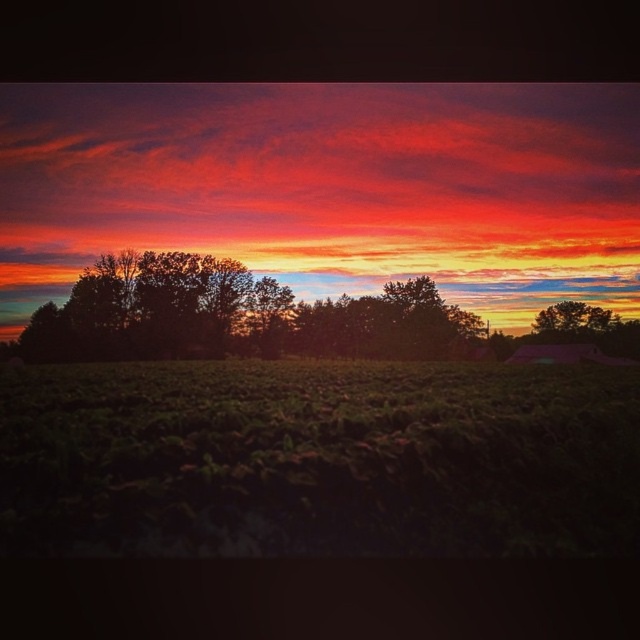
You are an artist trying to paint the sunset scene. You want to ensure the vivid orange cloud at upper center and the green leafy tree at right are proportionally accurate. Which object should you paint larger?

The vivid orange cloud at upper center should be painted larger because it is bigger than the green leafy tree at right according to the description.